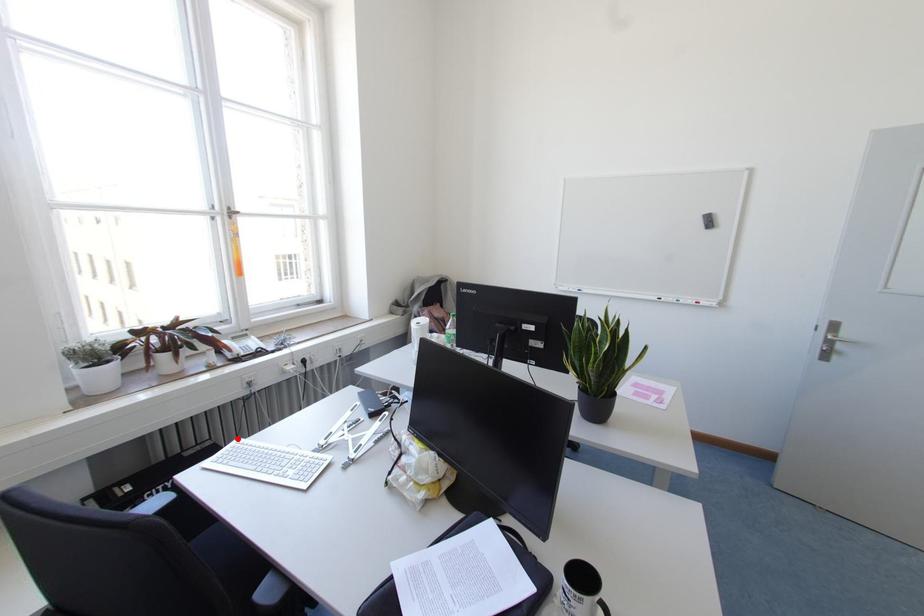
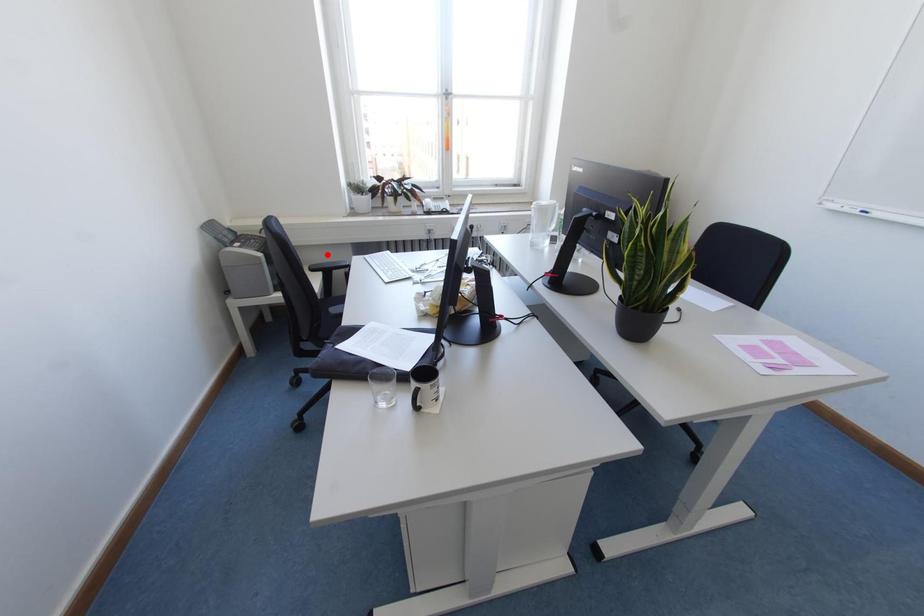
I am providing you with two images of the same scene from different viewpoints. A red point is marked on the first image and another point is marked on the second image. Is the marked point in image1 the same physical position as the marked point in image2?

No